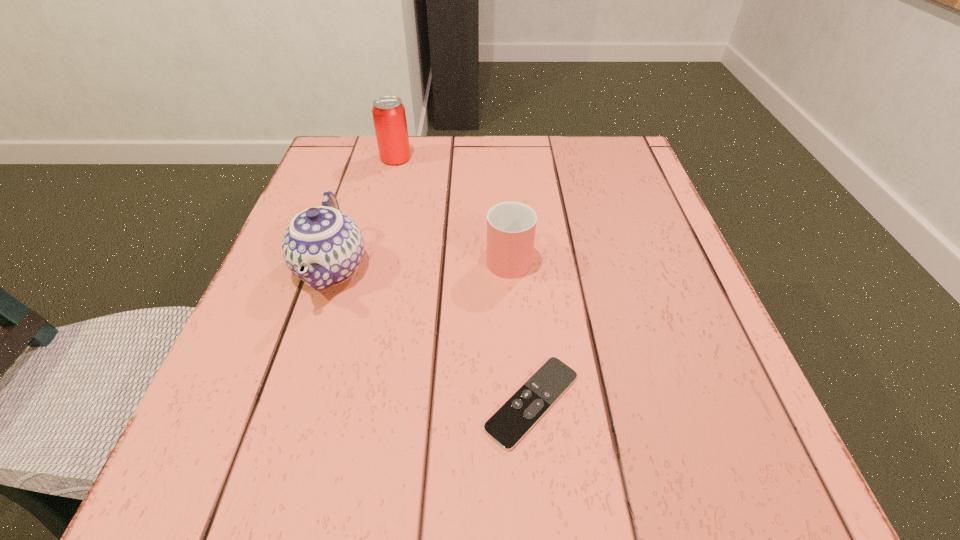
Find the location of a particular element. the farthest object is located at coordinates (389, 116).

Find the location of a particular element. chinaware is located at coordinates (322, 246).

This screenshot has width=960, height=540. Identify the location of cup. (511, 226).

In order to click on remote control in this screenshot , I will do `click(518, 415)`.

Identify the location of the nearest object. The height and width of the screenshot is (540, 960). (518, 415).

At what (x,y) coordinates should I click in order to perform the action: click on vacant area located 0.190m on the front of the farthest object. Please return your answer as a coordinate pair (x, y). Looking at the image, I should click on (381, 217).

In order to click on free space located 0.260m from the spout of the chinaware in this screenshot , I will do `click(260, 481)`.

Where is `free point located on the side of the third tallest object with the handle`? The width and height of the screenshot is (960, 540). free point located on the side of the third tallest object with the handle is located at coordinates [x=503, y=167].

At what (x,y) coordinates should I click in order to perform the action: click on vacant space located on the side of the third tallest object with the handle. Please return your answer as a coordinate pair (x, y). This screenshot has width=960, height=540. Looking at the image, I should click on (503, 167).

Locate an element on the screen. Image resolution: width=960 pixels, height=540 pixels. free space located on the side of the third tallest object with the handle is located at coordinates (505, 206).